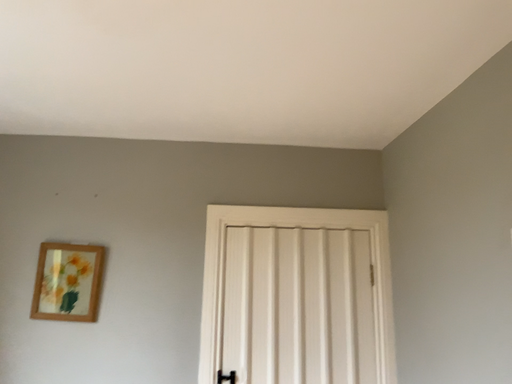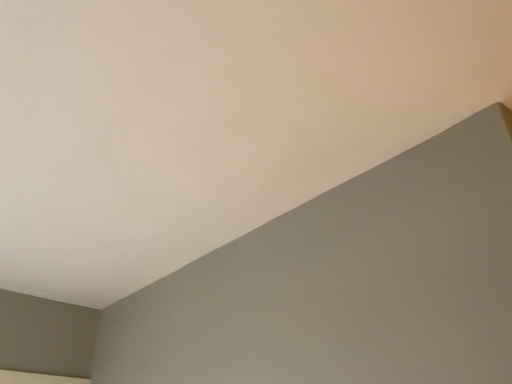
Question: Which way did the camera rotate in the video?

Choices:
 (A) rotated downward
 (B) rotated upward

Answer: (B)